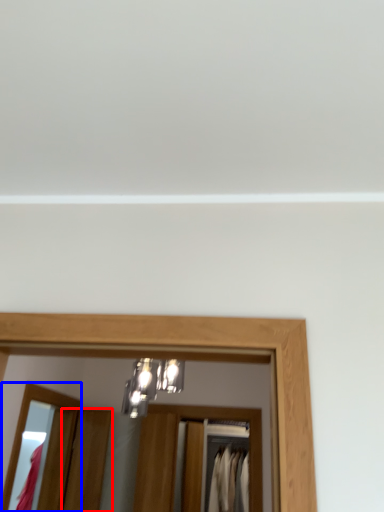
Question: Which point is closer to the camera, door (highlighted by a red box) or mirror (highlighted by a blue box)?

Choices:
 (A) door
 (B) mirror

Answer: (B)